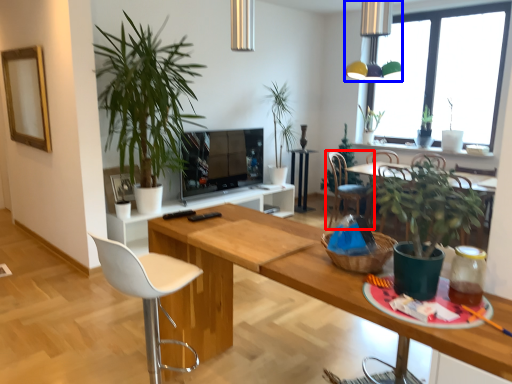
Question: Which point is further to the camera, chair (highlighted by a red box) or light fixture (highlighted by a blue box)?

Choices:
 (A) chair
 (B) light fixture

Answer: (A)